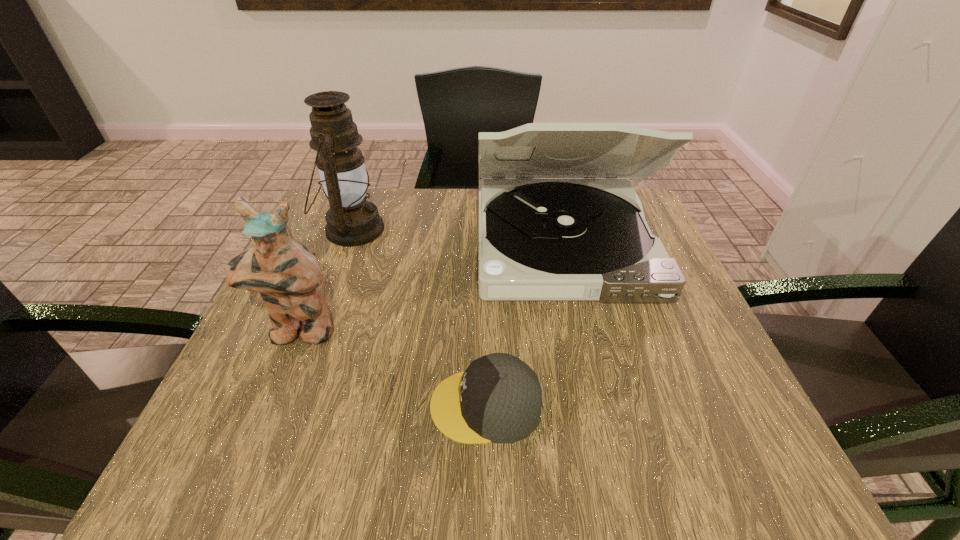
At what (x,y) coordinates should I click in order to perform the action: click on oil lamp. Please return your answer as a coordinate pair (x, y). The height and width of the screenshot is (540, 960). Looking at the image, I should click on (351, 220).

Find the location of a particular element. CD player is located at coordinates (539, 239).

Find the location of a particular element. This screenshot has width=960, height=540. figurine is located at coordinates (286, 274).

The height and width of the screenshot is (540, 960). I want to click on cap, so click(498, 399).

Identify the location of the nearest object. (498, 399).

At what (x,y) coordinates should I click in order to perform the action: click on blank area located 0.310m on the front of the oil lamp. Please return your answer as a coordinate pair (x, y). Looking at the image, I should click on (298, 372).

Locate an element on the screen. The width and height of the screenshot is (960, 540). free region located on the control panel of the CD player is located at coordinates (604, 413).

Image resolution: width=960 pixels, height=540 pixels. I want to click on free spot located 0.130m on the front-facing side of the second nearest object, so click(264, 416).

Identify the location of free space located 0.270m on the front-facing side of the nearest object. The width and height of the screenshot is (960, 540). (x=258, y=406).

Image resolution: width=960 pixels, height=540 pixels. I want to click on vacant space positioned 0.150m on the front-facing side of the nearest object, so click(335, 406).